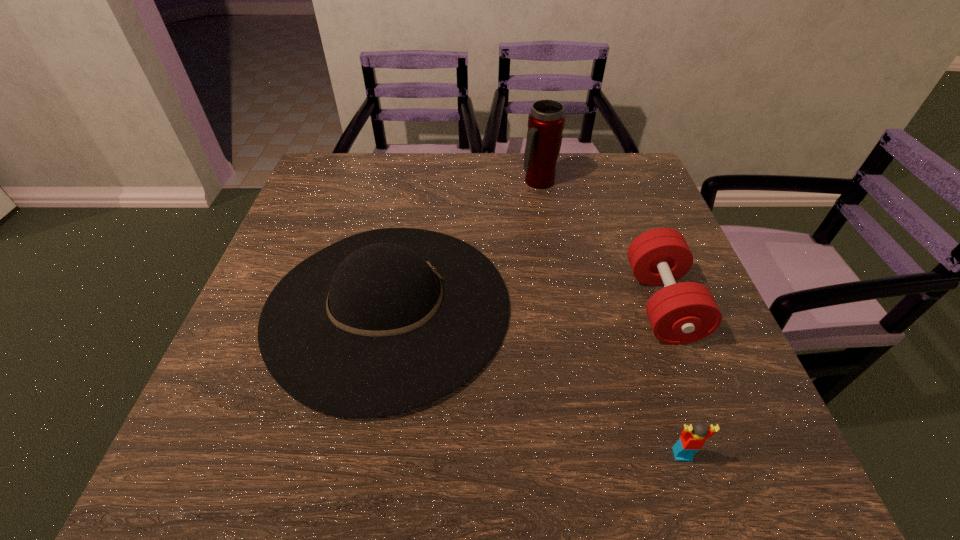
You are a GUI agent. You are given a task and a screenshot of the screen. Output one action in this format:
    pyautogui.click(x=<x>, y=<y>)
    Task: Click on the object present at the far edge
    Image resolution: width=960 pixels, height=540 pixels.
    Given the screenshot: What is the action you would take?
    pyautogui.click(x=546, y=120)

Locate an element on the screen. object at the near edge is located at coordinates (692, 439).

Find the location of a particular element. The height and width of the screenshot is (540, 960). object that is at the left edge is located at coordinates (385, 321).

You are a GUI agent. You are given a task and a screenshot of the screen. Output one action in this format:
    pyautogui.click(x=<x>, y=<y>)
    Task: Click on the dumbbell present at the right edge
    
    Given the screenshot: What is the action you would take?
    pyautogui.click(x=680, y=313)

Identify the location of Lego located in the right edge section of the desktop. This screenshot has width=960, height=540. (692, 439).

Image resolution: width=960 pixels, height=540 pixels. I want to click on object located at the near right corner, so click(x=692, y=439).

Where is `vacant area at the far edge of the desktop`? The width and height of the screenshot is (960, 540). vacant area at the far edge of the desktop is located at coordinates (468, 178).

You are a GUI agent. You are given a task and a screenshot of the screen. Output one action in this format:
    pyautogui.click(x=<x>, y=<y>)
    Task: Click on the free space at the left edge of the desktop
    The height and width of the screenshot is (540, 960).
    Given the screenshot: What is the action you would take?
    pyautogui.click(x=310, y=217)

The image size is (960, 540). In the image, there is a desktop. Find the location of `vacant space at the right edge`. vacant space at the right edge is located at coordinates (637, 232).

This screenshot has width=960, height=540. In the image, there is a desktop. What are the coordinates of `vacant area at the near left corner` in the screenshot? It's located at (277, 469).